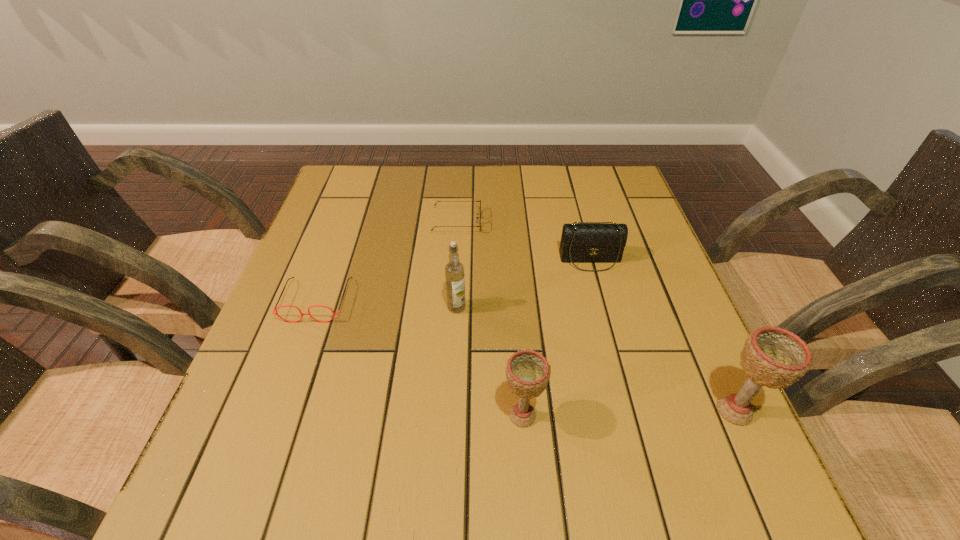
Locate an element on the screen. The image size is (960, 540). the leftmost object is located at coordinates (275, 309).

Where is `vacant space located on the left of the shorter chalice`? The height and width of the screenshot is (540, 960). vacant space located on the left of the shorter chalice is located at coordinates (349, 415).

The width and height of the screenshot is (960, 540). I want to click on free space located 0.250m on the left of the taller chalice, so click(569, 410).

Find the location of a particular element. free space located on the front flap of the second farthest object is located at coordinates (609, 328).

This screenshot has height=540, width=960. Identify the location of vacant space positioned 0.250m on the front-facing side of the sunglasses. (574, 221).

At what (x,y) coordinates should I click in order to perform the action: click on free space located 0.210m on the label of the vodka. Please return your answer as a coordinate pair (x, y). Looking at the image, I should click on (452, 402).

The width and height of the screenshot is (960, 540). I want to click on vacant space located on the front-facing side of the second shortest object, so click(276, 414).

In order to click on object at the far edge in this screenshot , I will do `click(477, 218)`.

Identify the location of object located in the left edge section of the desktop. This screenshot has width=960, height=540. (275, 309).

Where is `chalice that is at the right edge`? chalice that is at the right edge is located at coordinates (773, 357).